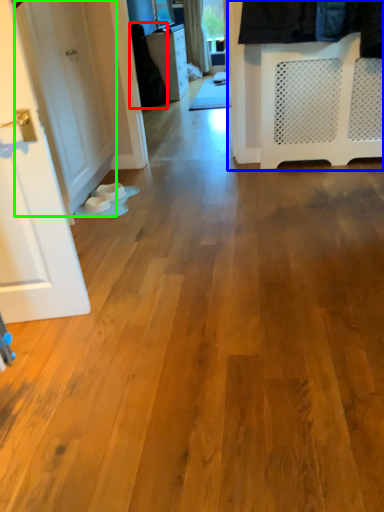
Question: Based on their relative distances, which object is nearer to clothing (highlighted by a red box)? Choose from closet (highlighted by a blue box) and door (highlighted by a green box).

Choices:
 (A) closet
 (B) door

Answer: (B)